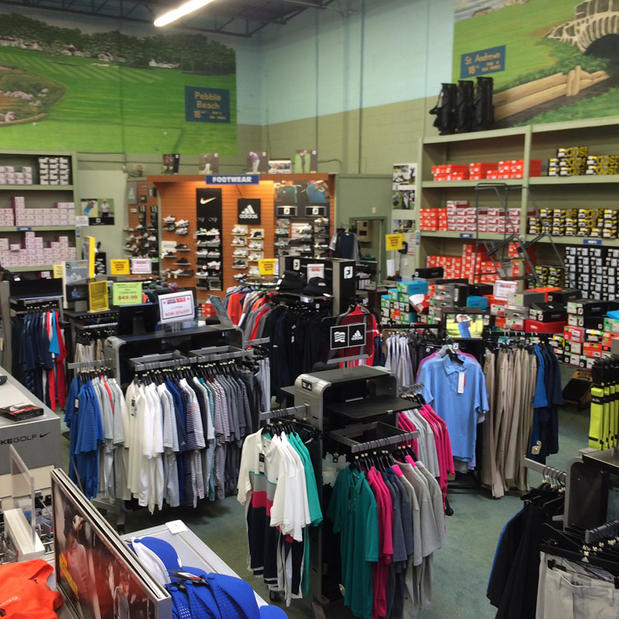
Identify the location of walls. Image resolution: width=619 pixels, height=619 pixels. (384, 101), (93, 111).